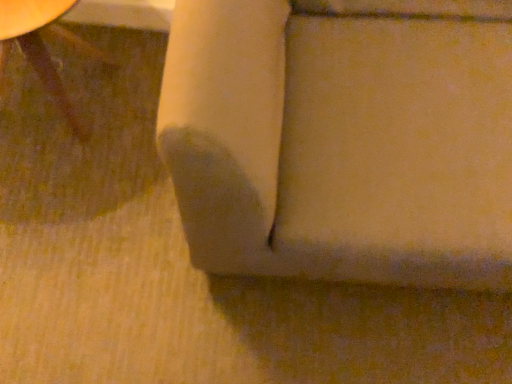
This screenshot has height=384, width=512. In order to click on free space to the right of matte brown wood table at lower left, placed as the second furniture when sorted from right to left in this screenshot , I will do `click(145, 126)`.